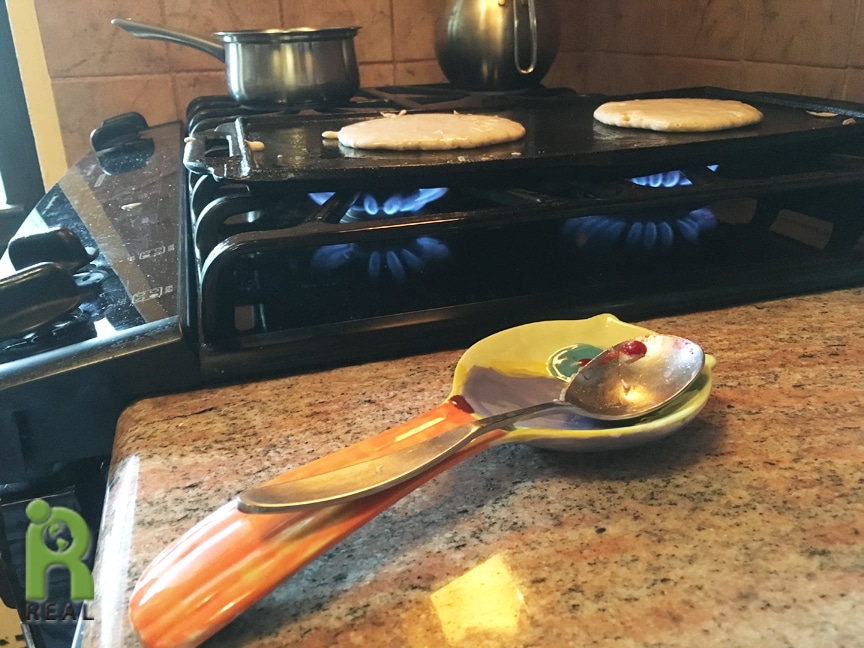
Identify the location of stove knobes. Image resolution: width=864 pixels, height=648 pixels. (118, 129), (64, 249), (60, 299).